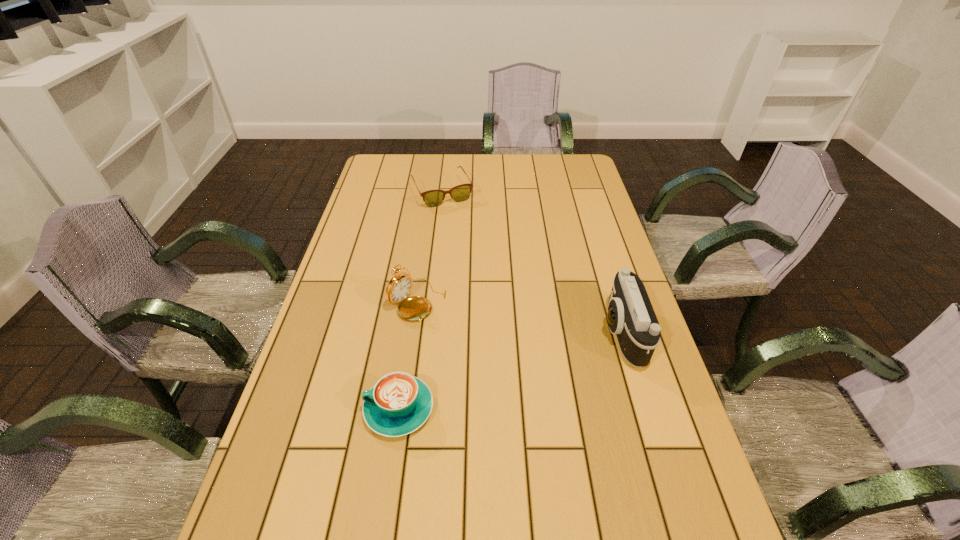
This screenshot has height=540, width=960. I want to click on cappuccino, so click(398, 404).

Find the location of `the rightmost object`. the rightmost object is located at coordinates (630, 316).

What are the coordinates of `pocket watch` in the screenshot? It's located at (415, 308).

This screenshot has width=960, height=540. I want to click on the farthest object, so click(432, 198).

At what (x,y) coordinates should I click in order to perform the action: click on vacant position located with the handle on the right side of the cappuccino. Please return your answer as a coordinate pair (x, y). The image size is (960, 540). Looking at the image, I should click on (321, 409).

Where is `free spot located 0.150m with the handle on the right side of the cappuccino`? Image resolution: width=960 pixels, height=540 pixels. free spot located 0.150m with the handle on the right side of the cappuccino is located at coordinates (299, 409).

At what (x,y) coordinates should I click in order to perform the action: click on free space located 0.170m with the handle on the right side of the cappuccino. Please return your answer as a coordinate pair (x, y). Image resolution: width=960 pixels, height=540 pixels. Looking at the image, I should click on (290, 409).

Image resolution: width=960 pixels, height=540 pixels. Find the location of `vacant area situated 0.310m on the front lens of the camera`. vacant area situated 0.310m on the front lens of the camera is located at coordinates (486, 333).

You are a GUI agent. You are given a task and a screenshot of the screen. Output one action in this format:
    pyautogui.click(x=<x>, y=<y>)
    Task: Click on the vacant space situated 0.280m on the front lens of the camera
    
    Given the screenshot: What is the action you would take?
    pyautogui.click(x=497, y=333)

Locate an element on the screen. The height and width of the screenshot is (540, 960). vacant space positioned 0.270m on the front lens of the camera is located at coordinates (501, 333).